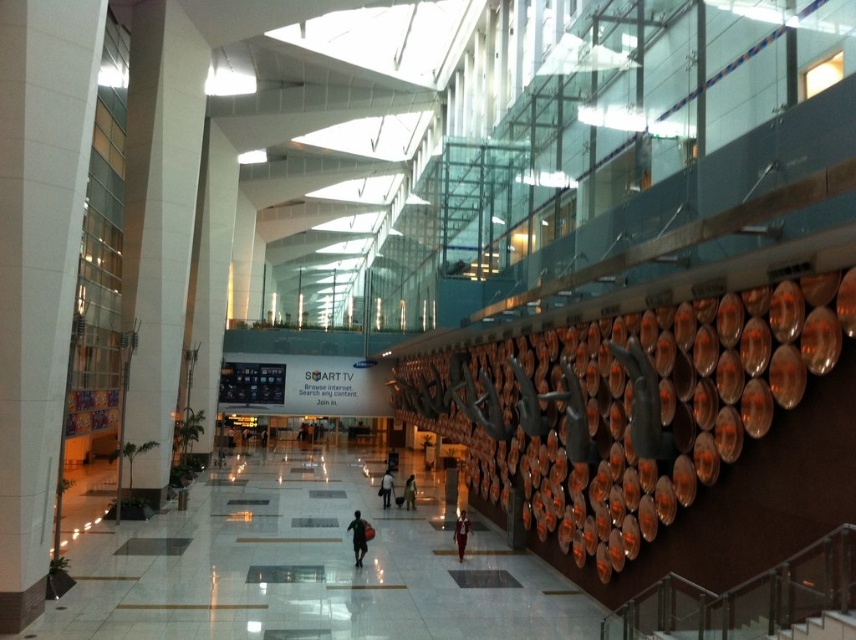
Between point (360, 540) and point (467, 534), which one is positioned behind?

Positioned behind is point (467, 534).

Is dark blue fabric at center taller than dark brown leather jacket at lower center?

Yes, dark blue fabric at center is taller than dark brown leather jacket at lower center.

Locate an element on the screen. dark blue fabric at center is located at coordinates (358, 536).

The width and height of the screenshot is (856, 640). Find the location of `dark blue fabric at center`. dark blue fabric at center is located at coordinates (358, 536).

Is dark brown leather jacket at lower center to the left of dark gray fabric bag at center from the viewer's perspective?

In fact, dark brown leather jacket at lower center is to the right of dark gray fabric bag at center.

You are a GUI agent. You are given a task and a screenshot of the screen. Output one action in this format:
    pyautogui.click(x=<x>, y=<y>)
    Task: Click on the dark brown leather jacket at lower center
    
    Given the screenshot: What is the action you would take?
    pyautogui.click(x=461, y=532)

Is point (464, 512) behind point (388, 476)?

That is True.

Where is `dark brown leather jacket at lower center`? dark brown leather jacket at lower center is located at coordinates (461, 532).

Can you confirm if dark blue fabric at center is taller than dark gray fabric bag at center?

No, dark blue fabric at center is not taller than dark gray fabric bag at center.

Is point (355, 515) farther from viewer compared to point (378, 486)?

No.

Image resolution: width=856 pixels, height=640 pixels. Find the location of `dark blue fabric at center`. dark blue fabric at center is located at coordinates (358, 536).